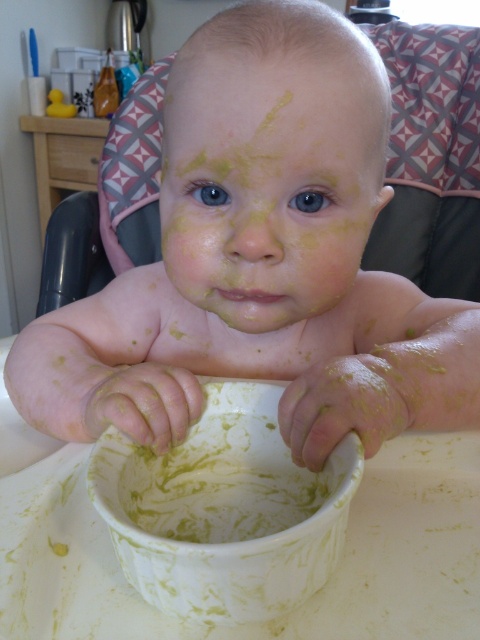
Is point (282, 221) positioned before point (217, 508)?

No, (282, 221) is behind (217, 508).

Is point (311, 65) positioned after point (205, 529)?

That is True.

Between point (252, 266) and point (308, 508), which one is positioned in front?

Positioned in front is point (308, 508).

Where is `yellow matte face at center`? The height and width of the screenshot is (640, 480). yellow matte face at center is located at coordinates pos(267,184).

Consider the image. Which is more to the right, yellow matte face at center or white matte bowl at center?

Positioned to the right is yellow matte face at center.

Which is more to the left, yellow matte face at center or white matte bowl at center?

Positioned to the left is white matte bowl at center.

Does point (255, 77) lie in front of point (167, 458)?

Yes, point (255, 77) is in front of point (167, 458).

The width and height of the screenshot is (480, 640). Identify the location of yellow matte face at center. (267, 184).

Does point (223, 534) come behind point (255, 499)?

That is False.

In the scene shown: Can you confirm if white matte bowl at center is positioned to the right of yellow matte bowl at center?

Indeed, white matte bowl at center is positioned on the right side of yellow matte bowl at center.

Is point (261, 413) positioned after point (230, 444)?

No, (261, 413) is in front of (230, 444).

Find the location of `white matte bowl at center`. white matte bowl at center is located at coordinates (225, 512).